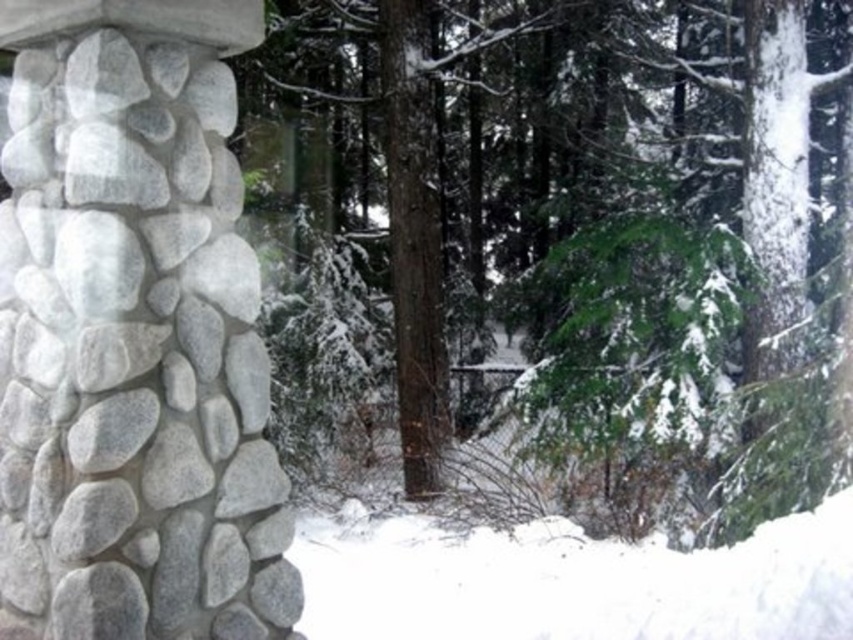
Can you confirm if gray stone column at left is smaller than white fluffy snow at lower center?

Incorrect, gray stone column at left is not smaller in size than white fluffy snow at lower center.

Does point (248, 284) come closer to viewer compared to point (514, 557)?

Yes, it is.

Is point (96, 278) closer to camera compared to point (531, 600)?

Yes, point (96, 278) is in front of point (531, 600).

This screenshot has width=853, height=640. Identify the location of gray stone column at left. (132, 333).

Is green textured evergreen tree at center shorter than white fluffy snow at lower center?

In fact, green textured evergreen tree at center may be taller than white fluffy snow at lower center.

Between green textured evergreen tree at center and white fluffy snow at lower center, which one has less height?

With less height is white fluffy snow at lower center.

Locate an element on the screen. Image resolution: width=853 pixels, height=640 pixels. green textured evergreen tree at center is located at coordinates (578, 252).

Locate an element on the screen. green textured evergreen tree at center is located at coordinates (578, 252).

Can you confirm if green textured evergreen tree at center is positioned to the right of gray stone column at left?

Indeed, green textured evergreen tree at center is positioned on the right side of gray stone column at left.

Can you confirm if green textured evergreen tree at center is thinner than gray stone column at left?

Incorrect, green textured evergreen tree at center's width is not less than gray stone column at left's.

Measure the distance between point (583,387) and camera.

They are 9.59 meters apart.

You are a GUI agent. You are given a task and a screenshot of the screen. Output one action in this format:
    pyautogui.click(x=<x>, y=<y>)
    Task: Click on the green textured evergreen tree at center
    This screenshot has height=640, width=853.
    Given the screenshot: What is the action you would take?
    pyautogui.click(x=578, y=252)